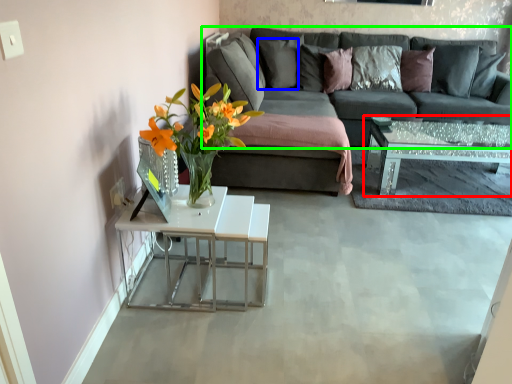
Question: Considering the real-world distances, which object is closest to coffee table (highlighted by a red box)? pillow (highlighted by a blue box) or studio couch (highlighted by a green box).

Choices:
 (A) pillow
 (B) studio couch

Answer: (B)